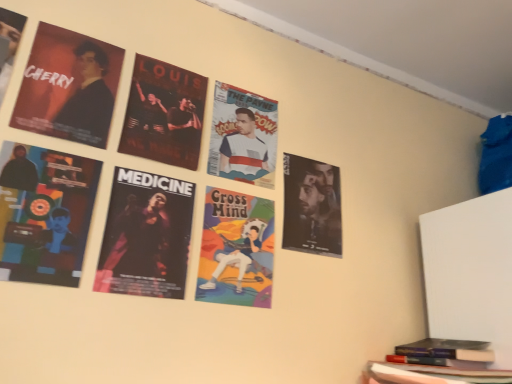
Question: Visually, is matte black poster at upper left, the third poster when ordered from left to right, positioned to the left or to the right of dark matte poster at center-left, which ranks as the fourth poster in left-to-right order?

Choices:
 (A) right
 (B) left

Answer: (B)

Question: From the image's perspective, is matte black poster at upper left, the third poster when ordered from left to right, positioned above or below dark matte poster at center-left, marked as the third poster in a right-to-left arrangement?

Choices:
 (A) below
 (B) above

Answer: (B)

Question: Considering the real-world distances, which object is farthest from the dark matte poster at center-left, marked as the third poster in a right-to-left arrangement?

Choices:
 (A) matte black poster at upper left, the sixth poster when ordered from right to left
 (B) matte black poster at right, the 1th poster when ordered from right to left
 (C) hardcover book at lower right
 (D) matte black poster at upper left, the third poster when ordered from left to right
 (E) matte black poster at upper center, which appears as the second poster when viewed from the right

Answer: (C)

Question: Estimate the real-world distances between objects in this image. Which object is closer to the hardcover book at lower right?

Choices:
 (A) matte black poster at right, the sixth poster when ordered from left to right
 (B) matte black poster at upper left, the sixth poster when ordered from right to left
 (C) matte black poster at lower left, the second poster from the left
 (D) matte black poster at upper center, which appears as the second poster when viewed from the right
 (E) cartoonish paper poster at center

Answer: (A)